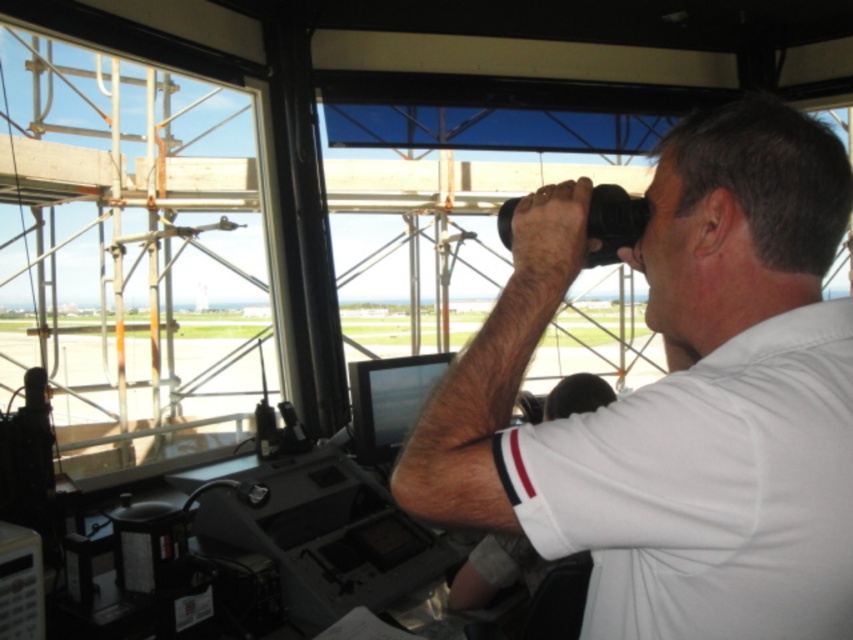
In order to click on white matte shirt at upper right in this screenshot , I will do 677,397.

Is white matte shirt at upper right thinner than clear glass window at upper left?

Indeed, white matte shirt at upper right has a lesser width compared to clear glass window at upper left.

Does point (532, 484) come closer to viewer compared to point (143, 358)?

Yes, point (532, 484) is in front of point (143, 358).

You are a GUI agent. You are given a task and a screenshot of the screen. Output one action in this format:
    pyautogui.click(x=<x>, y=<y>)
    Task: Click on the white matte shirt at upper right
    This screenshot has height=640, width=853.
    Given the screenshot: What is the action you would take?
    pyautogui.click(x=677, y=397)